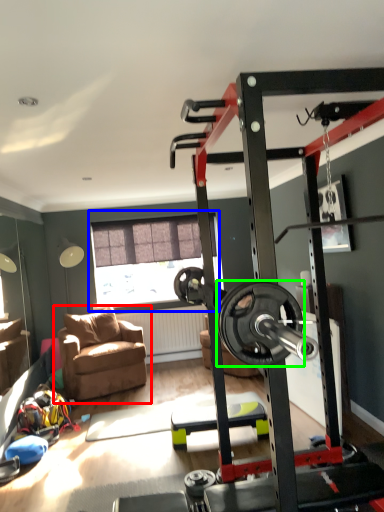
Question: Which object is the closest to the chair (highlighted by a red box)? Choose among these: window (highlighted by a blue box) or wheel (highlighted by a green box).

Choices:
 (A) window
 (B) wheel

Answer: (A)